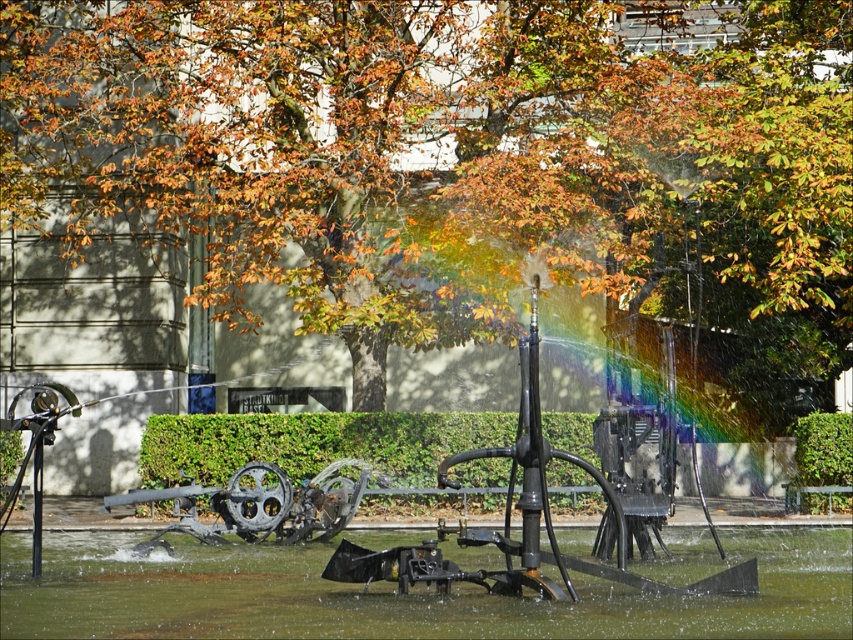
Question: Which object is the closest to the autumn leaves at center?

Choices:
 (A) green hedge at center
 (B) green leafy hedge at center
 (C) greenish water at center

Answer: (A)

Question: Which point is farther to the camera?

Choices:
 (A) green hedge at center
 (B) green leafy hedge at center
 (C) greenish water at center
 (D) autumn leaves at center

Answer: (B)

Question: Considering the relative positions of greenish water at center and green leafy hedge at center in the image provided, where is greenish water at center located with respect to green leafy hedge at center?

Choices:
 (A) below
 (B) above

Answer: (A)

Question: Does greenish water at center have a smaller size compared to green hedge at center?

Choices:
 (A) yes
 (B) no

Answer: (B)

Question: Which point is farther from the camera taking this photo?

Choices:
 (A) (9, 216)
 (B) (334, 605)
 (C) (379, 456)

Answer: (A)

Question: Where is green hedge at center located in relation to green leafy hedge at center in the image?

Choices:
 (A) above
 (B) below

Answer: (A)